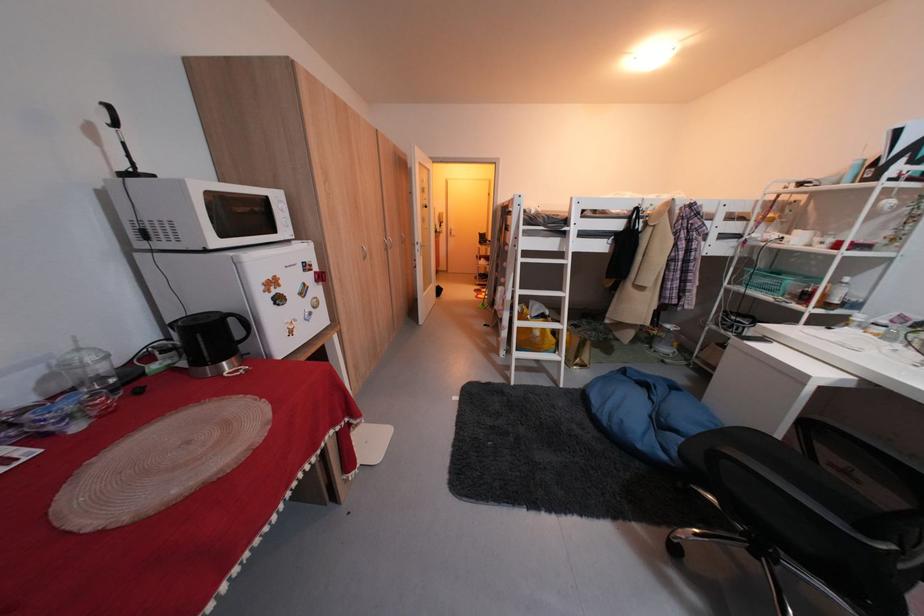
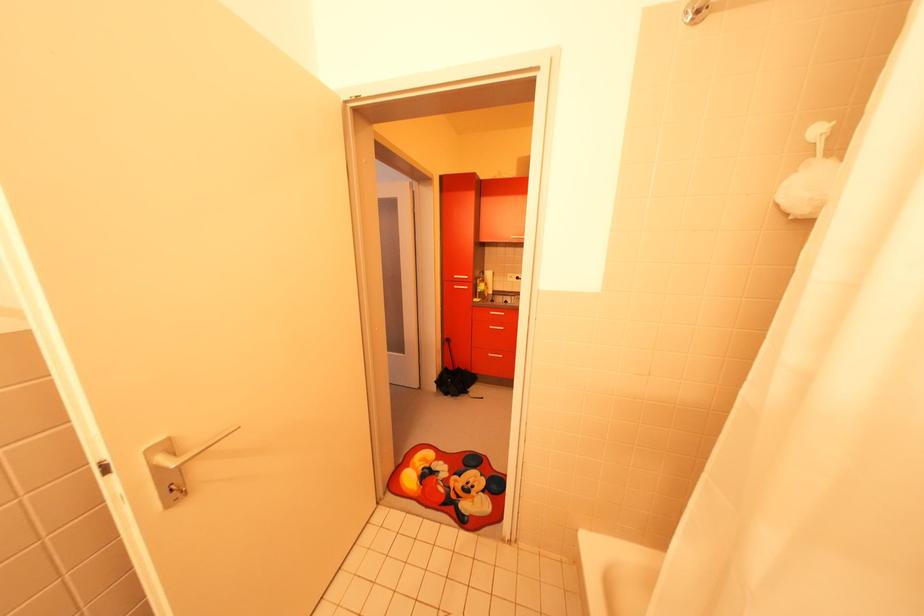
Question: I am providing you with two images of the same scene from different viewpoints. After the viewpoint changes to image2, which objects are now occluded?

Choices:
 (A) chrome shower head
 (B) white bath sponge
 (C) black cosmetic container
 (D) white microwave dial

Answer: (D)